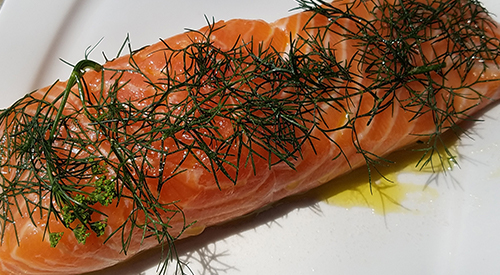
Locate an element on the screen. plate is located at coordinates (394, 244), (241, 245).